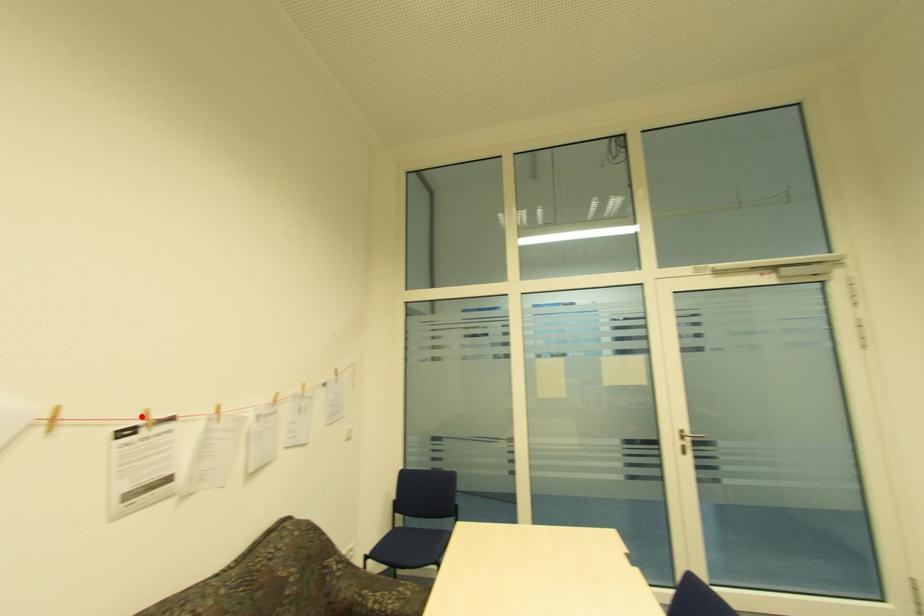
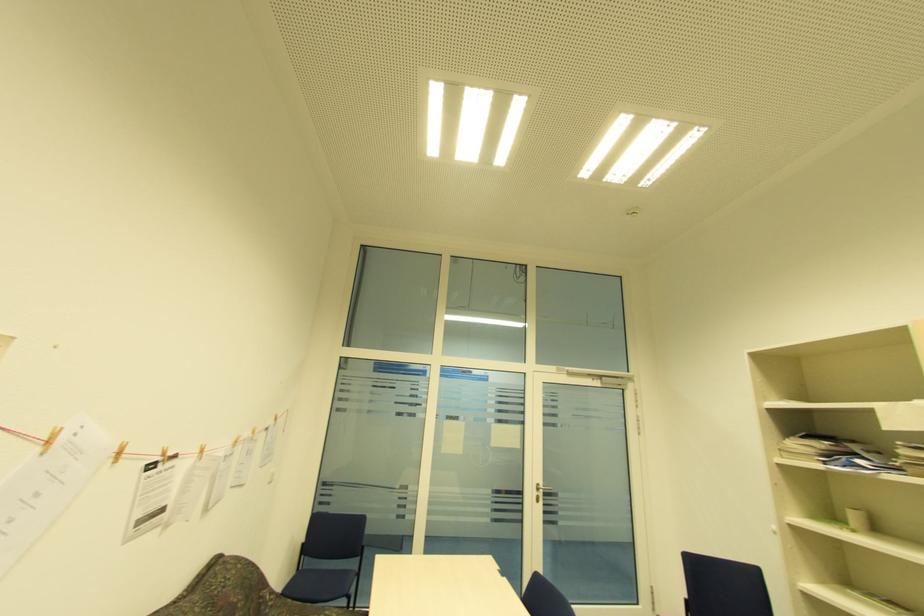
Find the pixel in the second image that matches the highlighted location in the first image.

(163, 454)